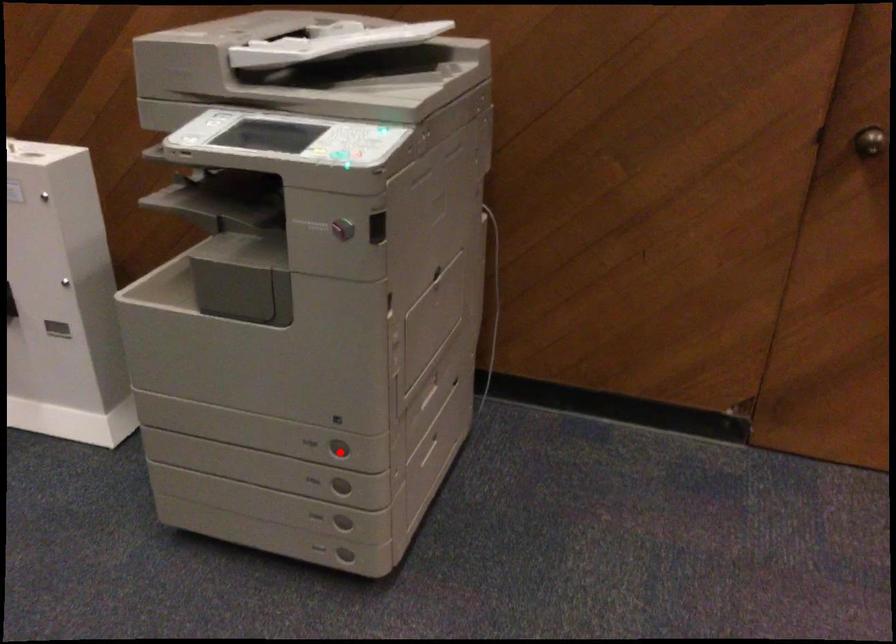
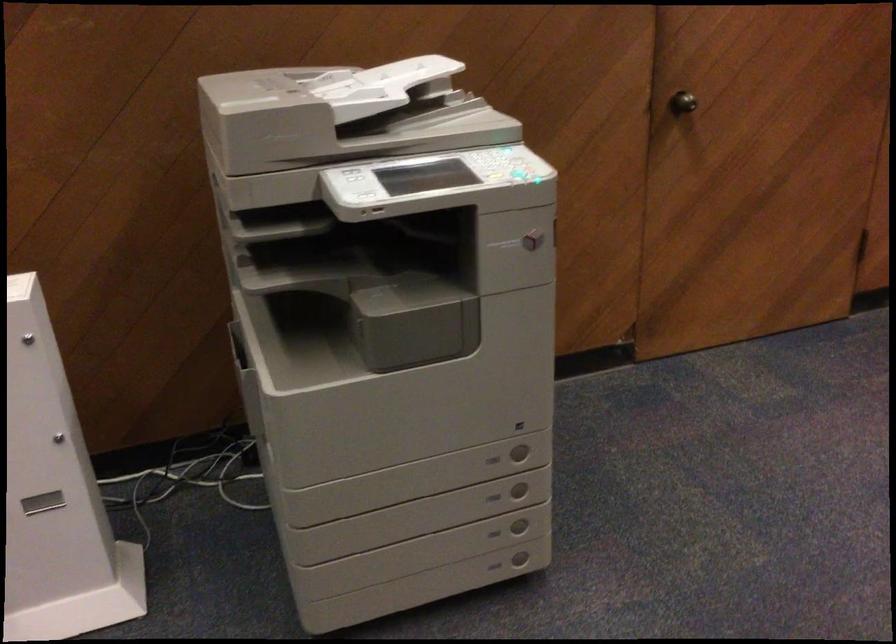
In the second image, find the point that corresponds to the highlighted location in the first image.

(519, 451)